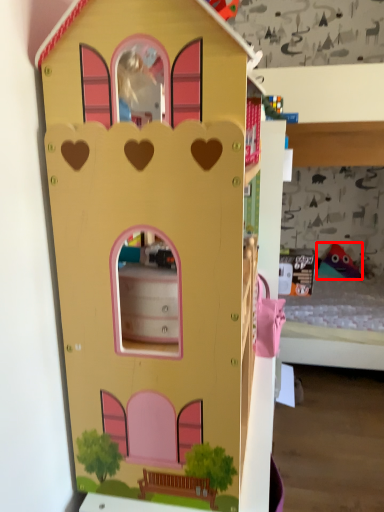
Question: From the image's perspective, where is toy (annotated by the red box) located in relation to toy in the image?

Choices:
 (A) above
 (B) below

Answer: (B)